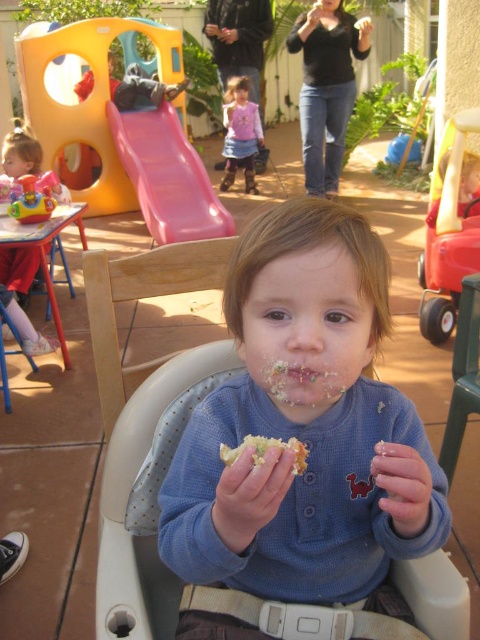
In the scene shown: Is matte pink high chair at left positioned at the back of crumbly bread at center?

Yes, matte pink high chair at left is further from the viewer.

Locate an element on the screen. The image size is (480, 640). matte pink high chair at left is located at coordinates (21, 292).

In order to click on matte pink high chair at left in this screenshot , I will do `click(21, 292)`.

Can you confirm if blue soft shirt at center is smaller than matte pink high chair at left?

Correct, blue soft shirt at center occupies less space than matte pink high chair at left.

Based on the photo, does blue soft shirt at center appear on the right side of matte pink high chair at left?

Correct, you'll find blue soft shirt at center to the right of matte pink high chair at left.

Is point (397, 468) in front of point (32, 150)?

Yes, it is.

You are a GUI agent. You are given a task and a screenshot of the screen. Output one action in this format:
    pyautogui.click(x=<x>, y=<y>)
    Task: Click on the blue soft shirt at center
    This screenshot has width=480, height=640.
    Given the screenshot: What is the action you would take?
    pyautogui.click(x=303, y=426)

Is blue soft shirt at center above pink plastic slide at upper center?

Actually, blue soft shirt at center is below pink plastic slide at upper center.

Can you confirm if blue soft shirt at center is positioned to the right of pink plastic slide at upper center?

Yes, blue soft shirt at center is to the right of pink plastic slide at upper center.

You are a GUI agent. You are given a task and a screenshot of the screen. Output one action in this format:
    pyautogui.click(x=<x>, y=<y>)
    Task: Click on the blue soft shirt at center
    
    Given the screenshot: What is the action you would take?
    pyautogui.click(x=303, y=426)

Identify the location of blue soft shirt at center. click(303, 426).